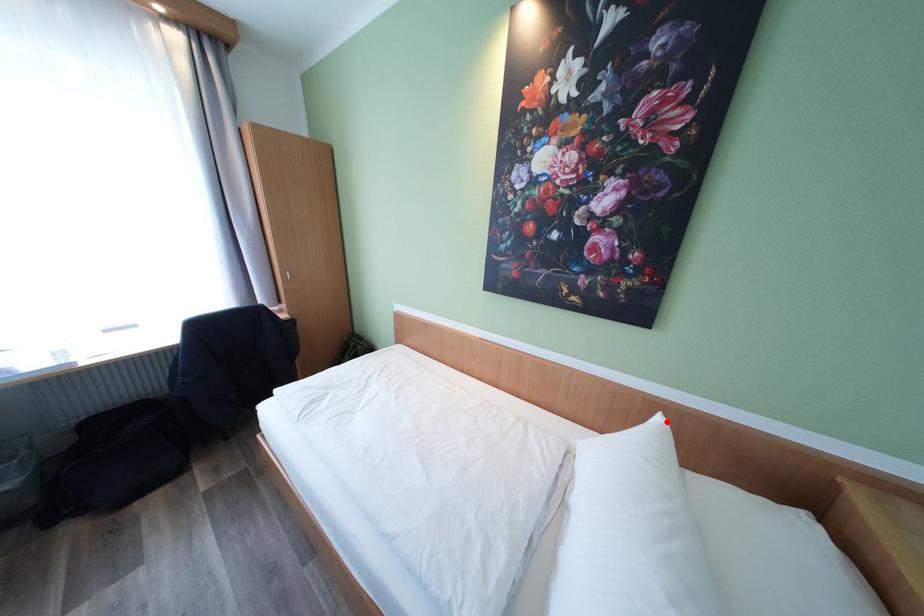
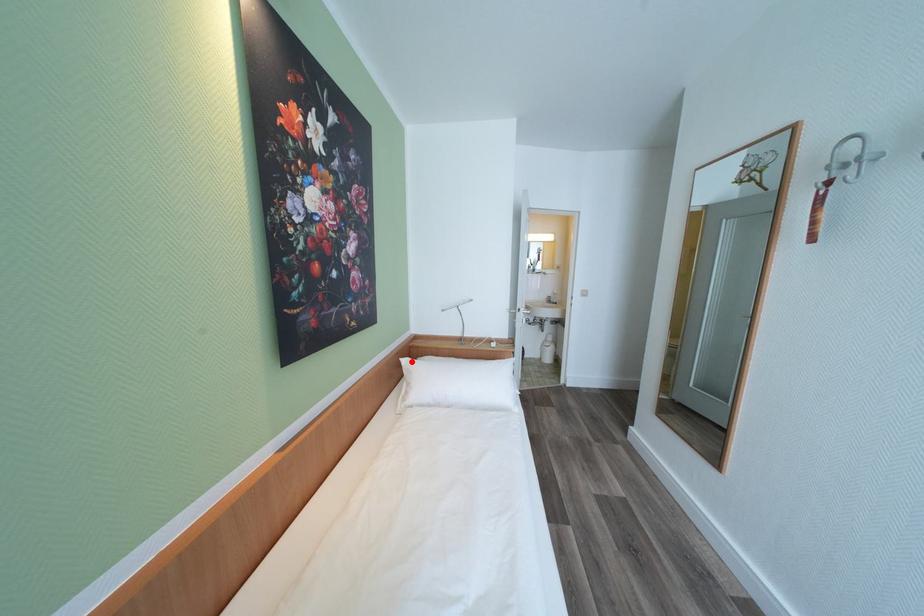
I am providing you with two images of the same scene from different viewpoints. A red point is marked on the first image and another point is marked on the second image. Are the points marked in image1 and image2 representing the same 3D position?

Yes